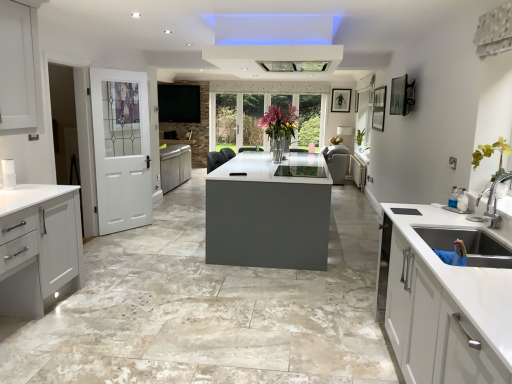
The image size is (512, 384). What do you see at coordinates (358, 172) in the screenshot? I see `white matte cabinet at center, the 1th cabinetry viewed from the top` at bounding box center [358, 172].

This screenshot has width=512, height=384. Describe the element at coordinates (279, 122) in the screenshot. I see `translucent glass vase at center` at that location.

Image resolution: width=512 pixels, height=384 pixels. I want to click on white glossy concrete at center, so click(x=209, y=310).

Is white glossy concrete at center at the right side of matte white cabinet at left, which is the first cabinetry in left-to-right order?

Correct, you'll find white glossy concrete at center to the right of matte white cabinet at left, which is the first cabinetry in left-to-right order.

What's the angular difference between white glossy concrete at center and matte white cabinet at left, placed as the 1th cabinetry when sorted from bottom to top,'s facing directions?

There is a 90.8-degree angle between the facing directions of white glossy concrete at center and matte white cabinet at left, placed as the 1th cabinetry when sorted from bottom to top.

From the image's perspective, is white glossy concrete at center on matte white cabinet at left, which is the first cabinetry in left-to-right order?

Yes, from the image's perspective, white glossy concrete at center is over matte white cabinet at left, which is the first cabinetry in left-to-right order.

Considering the sizes of objects white glossy concrete at center and translucent glass vase at center in the image provided, who is taller, white glossy concrete at center or translucent glass vase at center?

translucent glass vase at center.

Which of these two, white glossy concrete at center or translucent glass vase at center, is smaller?

Smaller between the two is translucent glass vase at center.

Consider the image. From the image's perspective, between white glossy concrete at center and translucent glass vase at center, which one is located above?

translucent glass vase at center appears higher in the image.

Considering their positions, is white glossy concrete at center located in front of or behind translucent glass vase at center?

In the image, white glossy concrete at center appears in front of translucent glass vase at center.

How different are the orientations of white painted wood door at left and white glossy concrete at center in degrees?

The angular difference between white painted wood door at left and white glossy concrete at center is 123 degrees.

Between white painted wood door at left and white glossy concrete at center, which one has more height?

With more height is white painted wood door at left.

Which is more to the left, white painted wood door at left or white glossy concrete at center?

Positioned to the left is white painted wood door at left.

Looking at their sizes, would you say white painted wood door at left is wider or thinner than white glossy concrete at center?

Considering their sizes, white painted wood door at left looks slimmer than white glossy concrete at center.

Considering the positions of objects translucent glass vase at center and white glossy concrete at center in the image provided, who is more to the right, translucent glass vase at center or white glossy concrete at center?

translucent glass vase at center is more to the right.

Between translucent glass vase at center and white glossy concrete at center, which one has larger width?

Wider between the two is white glossy concrete at center.

From a real-world perspective, is translucent glass vase at center on white glossy concrete at center?

Indeed, from a real-world perspective, translucent glass vase at center stands above white glossy concrete at center.

Which is in front, point (279, 133) or point (158, 351)?

Point (158, 351)

What's the angular difference between white glossy concrete at center and white matte cabinet at center, the first cabinetry positioned from the back,'s facing directions?

The angular difference between white glossy concrete at center and white matte cabinet at center, the first cabinetry positioned from the back, is 88.3 degrees.

Who is taller, white glossy concrete at center or white matte cabinet at center, which appears as the second cabinetry when viewed from the left?

white matte cabinet at center, which appears as the second cabinetry when viewed from the left, is taller.

From a real-world perspective, between white glossy concrete at center and white matte cabinet at center, which appears as the second cabinetry when viewed from the left, who is vertically lower?

From a 3D spatial view, white glossy concrete at center is below.

From a real-world perspective, is matte white cabinet at left, the second cabinetry from the right, on white glossy concrete at center?

Yes.

Could white glossy concrete at center be considered to be inside matte white cabinet at left, which is the first cabinetry in left-to-right order?

No, white glossy concrete at center is not surrounded by matte white cabinet at left, which is the first cabinetry in left-to-right order.

Which is farther, (25, 187) or (232, 303)?

The point (25, 187) is behind.

Considering the sizes of objects matte white cabinet at left, which is the first cabinetry in left-to-right order, and white glossy concrete at center in the image provided, who is taller, matte white cabinet at left, which is the first cabinetry in left-to-right order, or white glossy concrete at center?

matte white cabinet at left, which is the first cabinetry in left-to-right order.

How different are the orientations of white painted wood door at left and matte white cabinet at left, which ranks as the 2th cabinetry in back-to-front order, in degrees?

32.5 degrees separate the facing orientations of white painted wood door at left and matte white cabinet at left, which ranks as the 2th cabinetry in back-to-front order.

The image size is (512, 384). In order to click on door on the right of matte white cabinet at left, arranged as the first cabinetry when viewed from the front in this screenshot , I will do `click(121, 149)`.

How far apart are white painted wood door at left and matte white cabinet at left, which ranks as the 2th cabinetry in back-to-front order?

A distance of 2.11 meters exists between white painted wood door at left and matte white cabinet at left, which ranks as the 2th cabinetry in back-to-front order.

Is white painted wood door at left situated inside matte white cabinet at left, which ranks as the 2th cabinetry in back-to-front order, or outside?

white painted wood door at left is located beyond the bounds of matte white cabinet at left, which ranks as the 2th cabinetry in back-to-front order.

At what (x,y) coordinates should I click in order to perform the action: click on concrete above the matte white cabinet at left, arranged as the first cabinetry when viewed from the front (from the image's perspective). Please return your answer as a coordinate pair (x, y). This screenshot has width=512, height=384. Looking at the image, I should click on (209, 310).

Find the location of `floral arrangement located above the white glossy concrete at center (from a real-world perspective)`. floral arrangement located above the white glossy concrete at center (from a real-world perspective) is located at coordinates (279, 122).

Looking at this image, which object lies further to the anchor point matte white cabinet at left, which is the first cabinetry in left-to-right order, white painted wood door at left or white glossy concrete at center?

white painted wood door at left is further to matte white cabinet at left, which is the first cabinetry in left-to-right order.

When comparing their distances from white matte cabinet at center, the 1th cabinetry in the right-to-left sequence, does translucent glass vase at center or matte white cabinet at left, which ranks as the 2th cabinetry in back-to-front order, seem closer?

A: translucent glass vase at center is positioned closer to the anchor white matte cabinet at center, the 1th cabinetry in the right-to-left sequence.

Looking at the image, which one is located closer to matte white cabinet at left, which is the first cabinetry in left-to-right order, white glossy concrete at center or white painted wood door at left?

white glossy concrete at center is closer to matte white cabinet at left, which is the first cabinetry in left-to-right order.

When comparing their distances from white matte cabinet at center, the first cabinetry positioned from the back, does white glossy concrete at center or white painted wood door at left seem closer?

white painted wood door at left.

Which object lies nearer to the anchor point white glossy concrete at center, matte white cabinet at left, placed as the 1th cabinetry when sorted from bottom to top, or white painted wood door at left?

Among the two, matte white cabinet at left, placed as the 1th cabinetry when sorted from bottom to top, is located nearer to white glossy concrete at center.

Estimate the real-world distances between objects in this image. Which object is closer to white painted wood door at left, translucent glass vase at center or white matte cabinet at center, the second cabinetry ordered from the bottom?

translucent glass vase at center lies closer to white painted wood door at left than the other object.

Based on the photo, considering their positions, is white painted wood door at left positioned closer to matte white cabinet at left, arranged as the first cabinetry when viewed from the front, than translucent glass vase at center?

Among the two, white painted wood door at left is located nearer to matte white cabinet at left, arranged as the first cabinetry when viewed from the front.

From the image, which object appears to be nearer to translucent glass vase at center, white painted wood door at left or white glossy concrete at center?

The object closer to translucent glass vase at center is white painted wood door at left.

Find the location of a particular element. door positioned between matte white cabinet at left, which ranks as the 2th cabinetry in back-to-front order, and white matte cabinet at center, the first cabinetry positioned from the back, from near to far is located at coordinates (121, 149).

At what (x,y) coordinates should I click in order to perform the action: click on cabinetry located between white glossy concrete at center and white matte cabinet at center, the first cabinetry positioned from the back, in the depth direction. Please return your answer as a coordinate pair (x, y). Looking at the image, I should click on (39, 247).

The width and height of the screenshot is (512, 384). Identify the location of cabinetry positioned between white glossy concrete at center and translucent glass vase at center from near to far. (39, 247).

Identify the location of door located between matte white cabinet at left, placed as the 1th cabinetry when sorted from bottom to top, and translucent glass vase at center in the depth direction. (x=121, y=149).